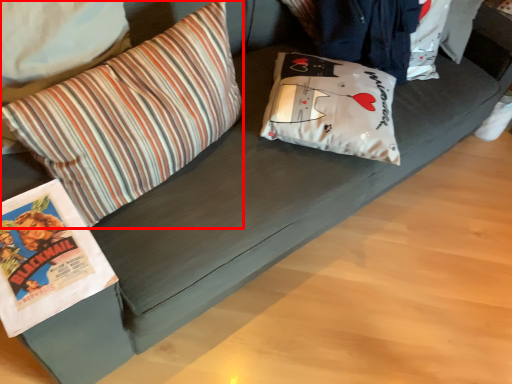
Question: Observing the image, what is the correct spatial positioning of pillow (annotated by the red box) in reference to pillow?

Choices:
 (A) right
 (B) left

Answer: (B)